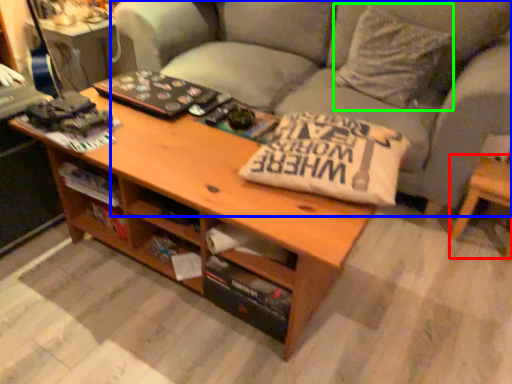
Question: Estimate the real-world distances between objects in this image. Which object is farther from side table (highlighted by a red box), studio couch (highlighted by a blue box) or throw pillow (highlighted by a green box)?

Choices:
 (A) studio couch
 (B) throw pillow

Answer: (A)